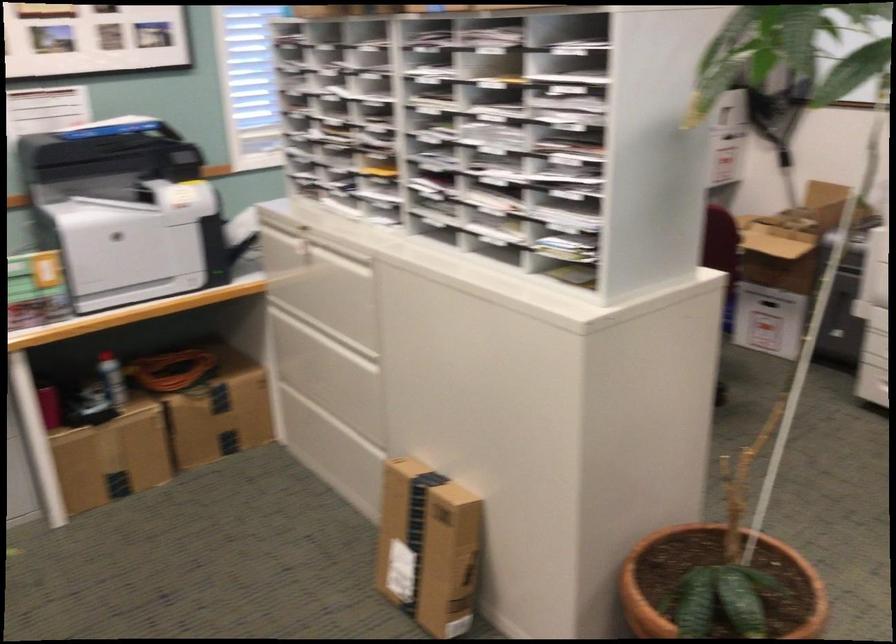
Image resolution: width=896 pixels, height=644 pixels. Identify the location of printer paper tray. (133, 250).